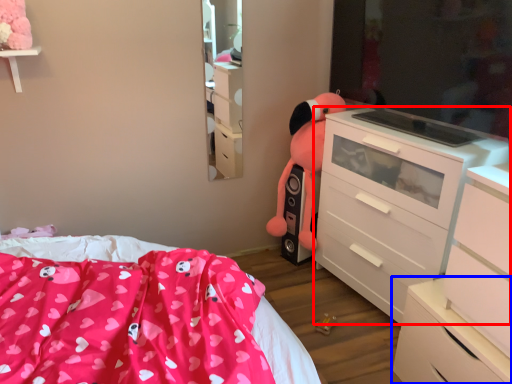
Question: Among these objects, which one is farthest to the camera, chest of drawers (highlighted by a red box) or chest of drawers (highlighted by a blue box)?

Choices:
 (A) chest of drawers
 (B) chest of drawers

Answer: (A)